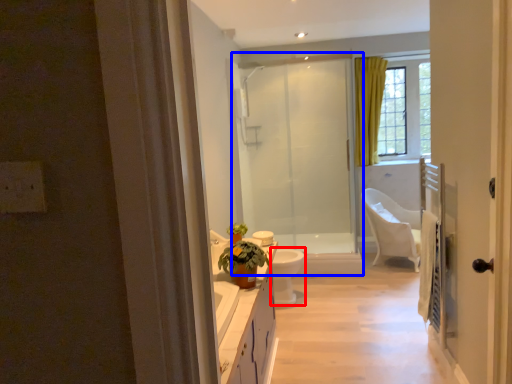
Question: Which of the following is the closest to the observer, toilet bowl (highlighted by a red box) or screen door (highlighted by a blue box)?

Choices:
 (A) toilet bowl
 (B) screen door

Answer: (A)